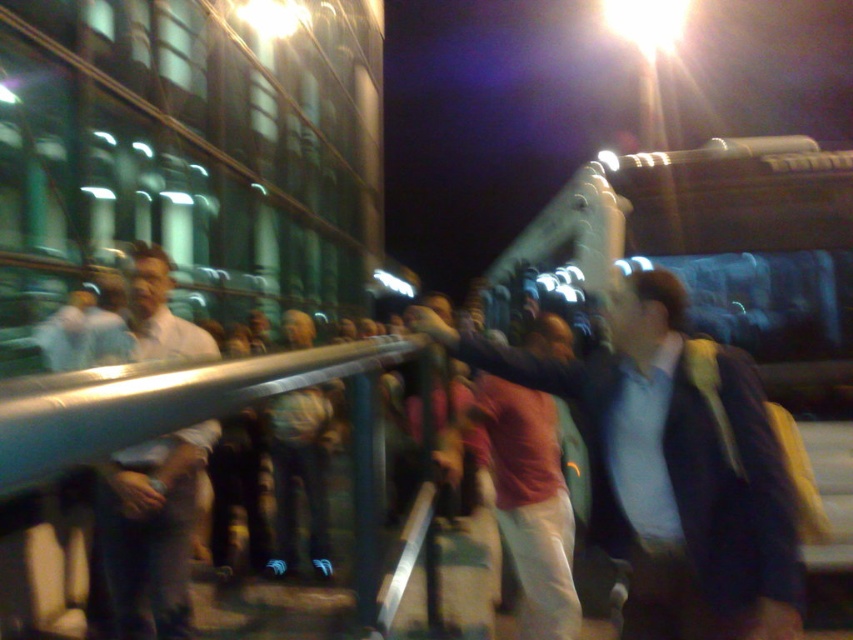
Question: Is the position of white shirt at left more distant than that of light blue shirt at center?

Choices:
 (A) yes
 (B) no

Answer: (B)

Question: Which object is farther from the camera taking this photo?

Choices:
 (A) white shirt at left
 (B) blue fabric jacket at center
 (C) denim pants at center
 (D) light blue shirt at center

Answer: (C)

Question: Is white shirt at left thinner than light blue shirt at center?

Choices:
 (A) yes
 (B) no

Answer: (B)

Question: Among these objects, which one is farthest from the camera?

Choices:
 (A) light blue shirt at center
 (B) blue fabric jacket at center
 (C) white shirt at left
 (D) denim pants at center

Answer: (D)

Question: Is white shirt at left behind denim pants at center?

Choices:
 (A) no
 (B) yes

Answer: (A)

Question: Which point is farther to the camera?

Choices:
 (A) denim pants at center
 (B) blue fabric jacket at center
 (C) light blue shirt at center

Answer: (A)